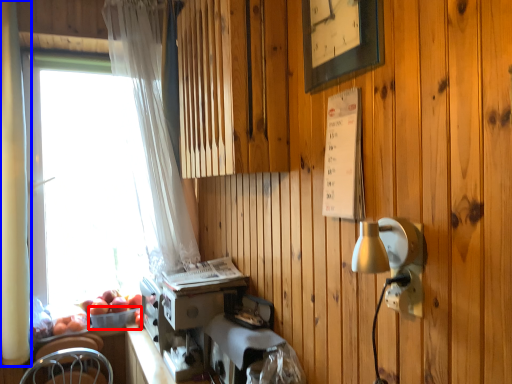
Question: Among these objects, which one is farthest to the camera, basket (highlighted by a red box) or curtain (highlighted by a blue box)?

Choices:
 (A) basket
 (B) curtain

Answer: (A)